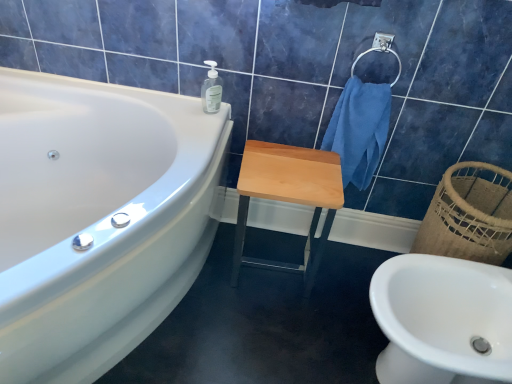
Locate an element on the screen. Image resolution: width=512 pixels, height=384 pixels. free point to the right of light wood/matte stool at center is located at coordinates (340, 275).